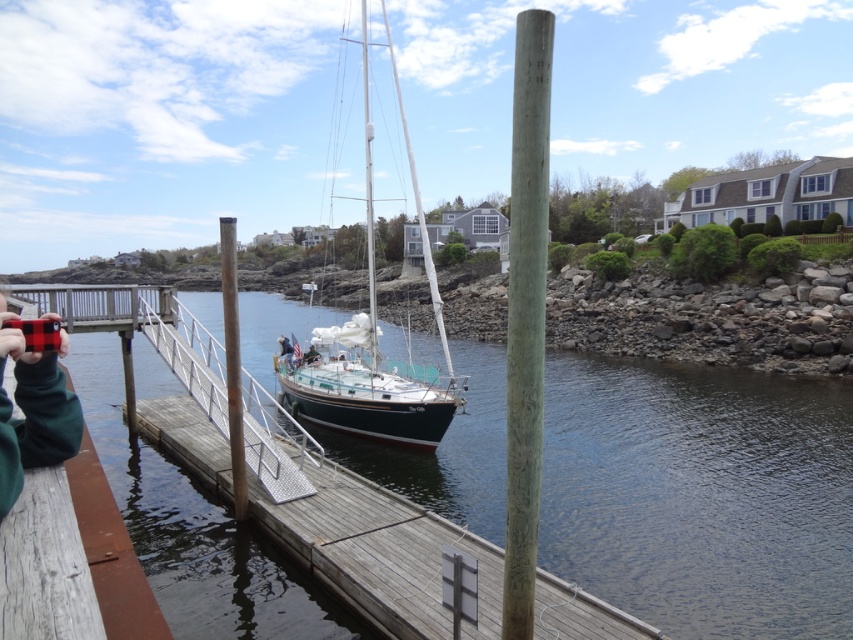
Question: Does white metal rail at center appear on the left side of red plaid fabric at lower left?

Choices:
 (A) no
 (B) yes

Answer: (B)

Question: Which point appears closest to the camera in this image?

Choices:
 (A) (375, 401)
 (B) (291, 362)
 (C) (20, 340)
 (D) (242, 394)

Answer: (C)

Question: Is shiny dark blue sailboat at center to the left of white fabric person at center from the viewer's perspective?

Choices:
 (A) no
 (B) yes

Answer: (B)

Question: Which point is closer to the camera?

Choices:
 (A) rustic wood post at center
 (B) green wood pole at center
 (C) smooth dark water at center
 (D) white metal rail at center

Answer: (B)

Question: Can you confirm if green wood pole at center is wider than white metal rail at center?

Choices:
 (A) yes
 (B) no

Answer: (A)

Question: Among these objects, which one is farthest from the camera?

Choices:
 (A) white metal rail at center
 (B) white fabric person at center
 (C) red plaid fabric at lower left
 (D) shiny dark blue sailboat at center

Answer: (B)